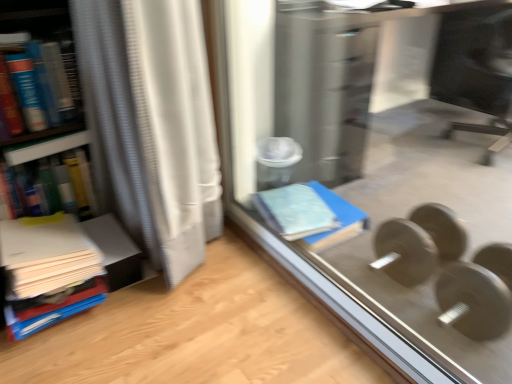
The image size is (512, 384). What are the coordinates of `vacant area located to the right-hand side of metallic gray dumbbell at lower right, the first dumbbell in the back-to-front sequence` in the screenshot? It's located at (464, 249).